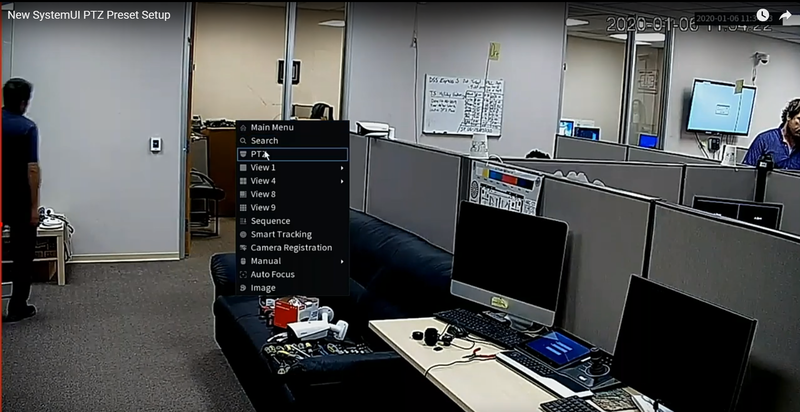
Find the location of `couch back`. couch back is located at coordinates (398, 262).